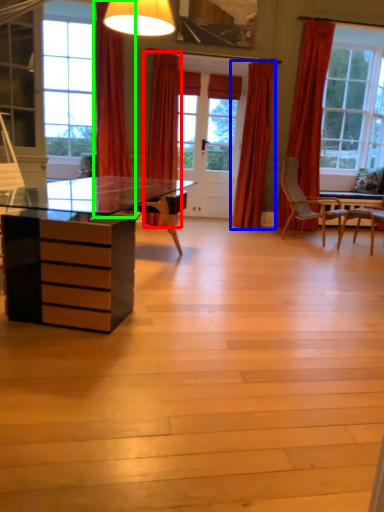
Question: Considering the real-world distances, which object is closest to curtain (highlighted by a red box)? curtain (highlighted by a blue box) or curtain (highlighted by a green box).

Choices:
 (A) curtain
 (B) curtain

Answer: (B)